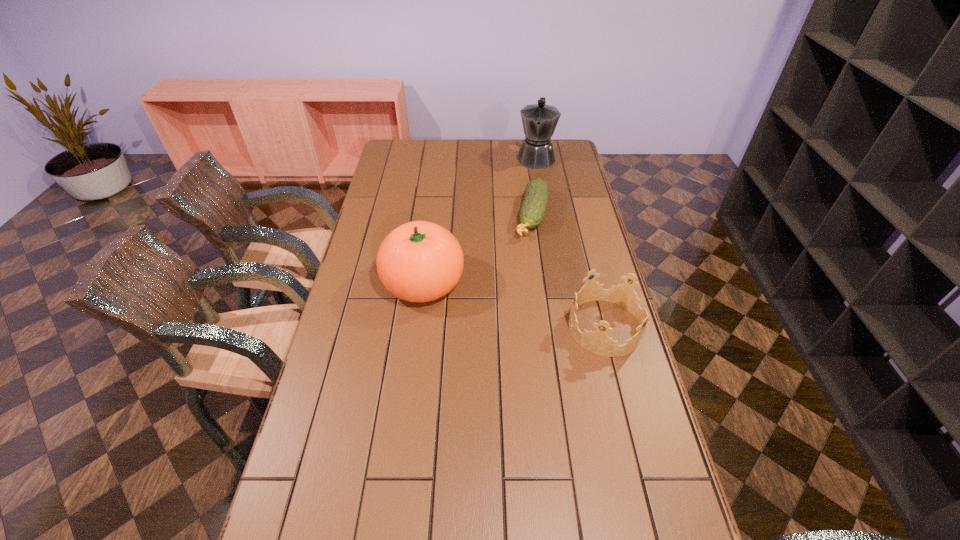
Identify the location of empty space between the tiara and the third shortest object. This screenshot has height=540, width=960. (515, 305).

Where is `unoccupied area between the second shortest object and the leftmost object`? The height and width of the screenshot is (540, 960). unoccupied area between the second shortest object and the leftmost object is located at coordinates (515, 305).

Where is `free space between the second shortest object and the coffeepot`? free space between the second shortest object and the coffeepot is located at coordinates (570, 242).

The image size is (960, 540). Identify the location of unoccupied area between the tiara and the cucumber. (569, 272).

Where is `object that is the second closest to the second tallest object`? This screenshot has width=960, height=540. object that is the second closest to the second tallest object is located at coordinates (598, 342).

The image size is (960, 540). What are the coordinates of `object that ranks as the second closest to the cucumber` in the screenshot? It's located at (420, 261).

Locate an element on the screen. This screenshot has height=540, width=960. vacant region that satisfies the following two spatial constraints: 1. on the front side of the second shortest object; 2. on the front-facing side of the coffeepot is located at coordinates (564, 327).

At what (x,y) coordinates should I click in order to perform the action: click on vacant space that satisfies the following two spatial constraints: 1. on the front side of the pumpkin; 2. on the front-facing side of the second shortest object. Please return your answer as a coordinate pair (x, y). Image resolution: width=960 pixels, height=540 pixels. Looking at the image, I should click on (418, 327).

Find the location of a particular element. The height and width of the screenshot is (540, 960). vacant space that satisfies the following two spatial constraints: 1. on the back side of the leftmost object; 2. on the left side of the farthest object is located at coordinates (439, 158).